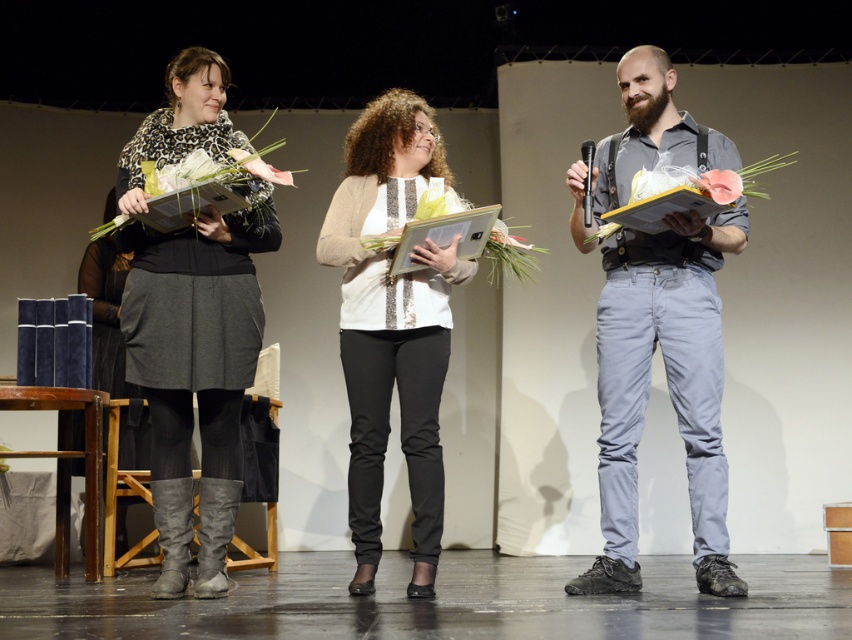
Question: Does white sequined blouse at center have a larger size compared to matte white flower at center?

Choices:
 (A) yes
 (B) no

Answer: (A)

Question: Does matte gray pants at center have a lesser width compared to white sequined blouse at center?

Choices:
 (A) yes
 (B) no

Answer: (B)

Question: Can you confirm if matte gray pants at center is positioned to the right of leopard print sweater at left?

Choices:
 (A) no
 (B) yes

Answer: (B)

Question: Based on their relative distances, which object is farther from the leopard print sweater at left?

Choices:
 (A) matte white flower at center
 (B) matte gray pants at center

Answer: (A)

Question: Which point is farther to the camera?

Choices:
 (A) (711, 358)
 (B) (740, 189)

Answer: (A)

Question: Which object is farther from the camera taking this photo?

Choices:
 (A) matte gray pants at center
 (B) leopard print sweater at left
 (C) matte white flower at center

Answer: (A)